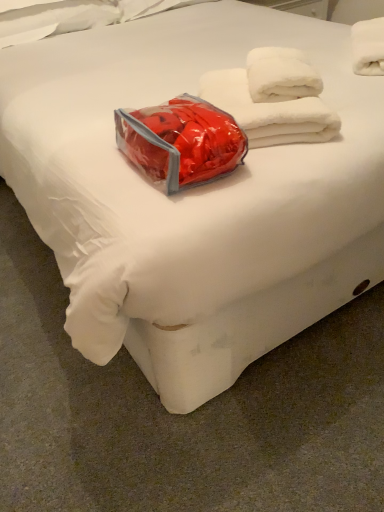
Find the location of `white fluffy towels at upper right, the first towel from the left`. white fluffy towels at upper right, the first towel from the left is located at coordinates (269, 112).

From a real-world perspective, is shiny plastic bag at center physically above white fluffy towels at upper right, the first towel from the left?

Yes, from a real-world perspective, shiny plastic bag at center is on top of white fluffy towels at upper right, the first towel from the left.

Does point (196, 101) appear closer or farther from the camera than point (277, 130)?

Point (196, 101) is closer to the camera than point (277, 130).

Based on the photo, considering the sizes of objects shiny plastic bag at center and white fluffy towels at upper right, marked as the second towel in a top-to-bottom arrangement, in the image provided, who is bigger, shiny plastic bag at center or white fluffy towels at upper right, marked as the second towel in a top-to-bottom arrangement,?

white fluffy towels at upper right, marked as the second towel in a top-to-bottom arrangement, is bigger.

Considering the relative sizes of shiny plastic bag at center and white fluffy towels at upper right, which is counted as the 1th towel, starting from the bottom, in the image provided, is shiny plastic bag at center shorter than white fluffy towels at upper right, which is counted as the 1th towel, starting from the bottom,?

Correct, shiny plastic bag at center is not as tall as white fluffy towels at upper right, which is counted as the 1th towel, starting from the bottom.

Does white fluffy towels at upper right, the first towel from the left, appear on the right side of white fluffy towel at upper right, the first towel from the right?

No.

From the image's perspective, is white fluffy towels at upper right, which is the 2th towel from right to left, above or below white fluffy towel at upper right, the first towel from the right?

white fluffy towels at upper right, which is the 2th towel from right to left, is below white fluffy towel at upper right, the first towel from the right.

From a real-world perspective, who is located higher, white fluffy towels at upper right, which is counted as the 1th towel, starting from the bottom, or white fluffy towel at upper right, placed as the second towel when sorted from bottom to top?

white fluffy towel at upper right, placed as the second towel when sorted from bottom to top, is physically above.

Between white fluffy towel at upper right, the first towel from the right, and white fluffy towels at upper right, the first towel from the left, which one has less height?

Answer: white fluffy towels at upper right, the first towel from the left.

Based on the photo, from a real-world perspective, who is located higher, white fluffy towel at upper right, positioned as the first towel in top-to-bottom order, or white fluffy towels at upper right, which is the 2th towel from right to left?

white fluffy towel at upper right, positioned as the first towel in top-to-bottom order, from a real-world perspective.

How different are the orientations of white fluffy towel at upper right, placed as the second towel when sorted from bottom to top, and white fluffy towels at upper right, the first towel from the left, in degrees?

The angle between the facing direction of white fluffy towel at upper right, placed as the second towel when sorted from bottom to top, and the facing direction of white fluffy towels at upper right, the first towel from the left, is 12.6 degrees.

From the image's perspective, relative to white fluffy towels at upper right, the first towel from the left, is white fluffy towel at upper right, positioned as the first towel in top-to-bottom order, above or below?

Based on their image positions, white fluffy towel at upper right, positioned as the first towel in top-to-bottom order, is located above white fluffy towels at upper right, the first towel from the left.

Is point (251, 109) more distant than point (176, 122)?

That is True.

Is white fluffy towels at upper right, which is the 2th towel from right to left, to the left of shiny plastic bag at center from the viewer's perspective?

In fact, white fluffy towels at upper right, which is the 2th towel from right to left, is to the right of shiny plastic bag at center.

Is white fluffy towels at upper right, marked as the second towel in a top-to-bottom arrangement, smaller than shiny plastic bag at center?

No.

Who is taller, white fluffy towels at upper right, which is counted as the 1th towel, starting from the bottom, or shiny plastic bag at center?

Standing taller between the two is white fluffy towels at upper right, which is counted as the 1th towel, starting from the bottom.

Does white fluffy towel at upper right, the first towel from the right, come behind shiny plastic bag at center?

That is True.

Between white fluffy towel at upper right, positioned as the first towel in top-to-bottom order, and shiny plastic bag at center, which one appears on the right side from the viewer's perspective?

white fluffy towel at upper right, positioned as the first towel in top-to-bottom order, is more to the right.

How many degrees apart are the facing directions of white fluffy towel at upper right, placed as the second towel when sorted from bottom to top, and shiny plastic bag at center?

The angle between the facing direction of white fluffy towel at upper right, placed as the second towel when sorted from bottom to top, and the facing direction of shiny plastic bag at center is 38.6 degrees.

Is white fluffy towel at upper right, the first towel from the right, smaller than shiny plastic bag at center?

Indeed, white fluffy towel at upper right, the first towel from the right, has a smaller size compared to shiny plastic bag at center.

Can you confirm if shiny plastic bag at center is shorter than white fluffy towel at upper right, the first towel from the right?

Yes, shiny plastic bag at center is shorter than white fluffy towel at upper right, the first towel from the right.

Is shiny plastic bag at center positioned behind white fluffy towel at upper right, arranged as the 2th towel when viewed from the left?

No, it is not.

Identify the location of towel that is the 1st object located above the shiny plastic bag at center (from the image's perspective). The width and height of the screenshot is (384, 512). coord(269,112).

I want to click on towel on the left of white fluffy towel at upper right, placed as the second towel when sorted from bottom to top, so click(x=269, y=112).

Looking at the image, which one is located further to shiny plastic bag at center, white fluffy towels at upper right, the first towel from the left, or white fluffy towel at upper right, the first towel from the right?

The object further to shiny plastic bag at center is white fluffy towel at upper right, the first towel from the right.

Based on the photo, when comparing their distances from white fluffy towels at upper right, the first towel from the left, does shiny plastic bag at center or white fluffy towel at upper right, arranged as the 2th towel when viewed from the left, seem further?

The object further to white fluffy towels at upper right, the first towel from the left, is white fluffy towel at upper right, arranged as the 2th towel when viewed from the left.

When comparing their distances from shiny plastic bag at center, does white fluffy towel at upper right, placed as the second towel when sorted from bottom to top, or white fluffy towels at upper right, which is counted as the 1th towel, starting from the bottom, seem closer?

white fluffy towels at upper right, which is counted as the 1th towel, starting from the bottom.

Looking at the image, which one is located closer to white fluffy towel at upper right, arranged as the 2th towel when viewed from the left, shiny plastic bag at center or white fluffy towels at upper right, the first towel from the left?

The object closer to white fluffy towel at upper right, arranged as the 2th towel when viewed from the left, is white fluffy towels at upper right, the first towel from the left.

From the image, which object appears to be farther from white fluffy towels at upper right, which is the 2th towel from right to left, white fluffy towel at upper right, placed as the second towel when sorted from bottom to top, or shiny plastic bag at center?

Based on the image, white fluffy towel at upper right, placed as the second towel when sorted from bottom to top, appears to be further to white fluffy towels at upper right, which is the 2th towel from right to left.

Considering their positions, is white fluffy towels at upper right, marked as the second towel in a top-to-bottom arrangement, positioned closer to white fluffy towel at upper right, positioned as the first towel in top-to-bottom order, than shiny plastic bag at center?

white fluffy towels at upper right, marked as the second towel in a top-to-bottom arrangement.

Find the location of a particular element. This screenshot has width=384, height=512. towel situated between shiny plastic bag at center and white fluffy towel at upper right, placed as the second towel when sorted from bottom to top, from left to right is located at coordinates (269, 112).